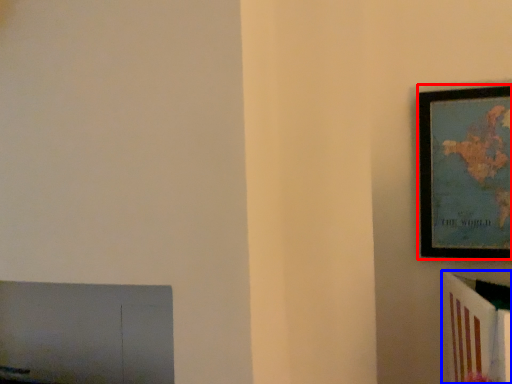
Question: Which object is further to the camera taking this photo, picture frame (highlighted by a red box) or furniture (highlighted by a blue box)?

Choices:
 (A) picture frame
 (B) furniture

Answer: (A)